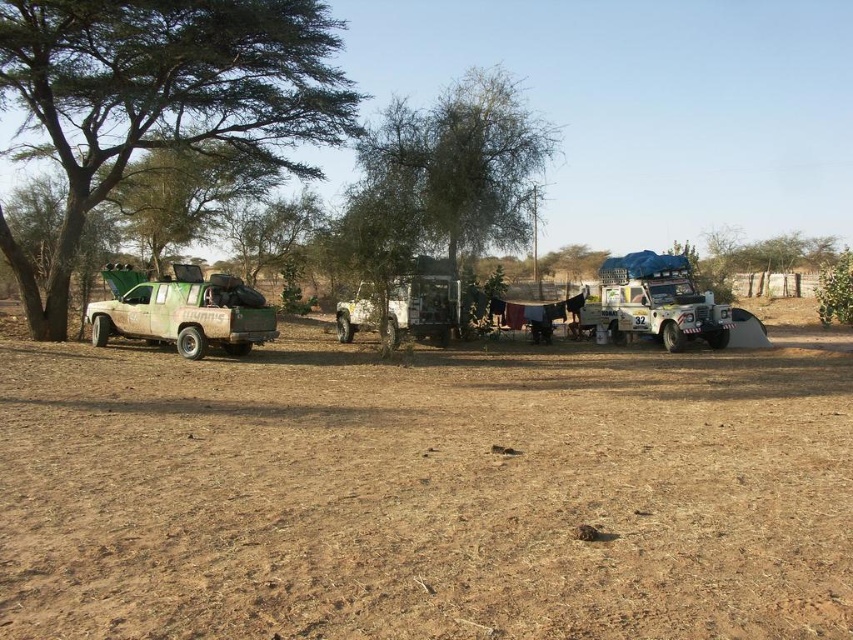
Looking at this image, does green camouflage truck at left have a smaller size compared to metallic silver jeep at center?

Correct, green camouflage truck at left occupies less space than metallic silver jeep at center.

Can you confirm if green camouflage truck at left is taller than metallic silver jeep at center?

In fact, green camouflage truck at left may be shorter than metallic silver jeep at center.

Identify the location of green camouflage truck at left. This screenshot has height=640, width=853. (183, 310).

Does brown dry soil at center come behind metallic silver jeep at center?

No, brown dry soil at center is closer to the viewer.

The width and height of the screenshot is (853, 640). Find the location of `brown dry soil at center`. brown dry soil at center is located at coordinates (422, 493).

Does blue tarpaulin jeep at center come behind metallic silver jeep at center?

That is True.

Which of these two, blue tarpaulin jeep at center or metallic silver jeep at center, stands taller?

blue tarpaulin jeep at center

Is point (612, 282) closer to camera compared to point (427, 289)?

No, (612, 282) is further to viewer.

Find the location of a particular element. The width and height of the screenshot is (853, 640). blue tarpaulin jeep at center is located at coordinates (659, 301).